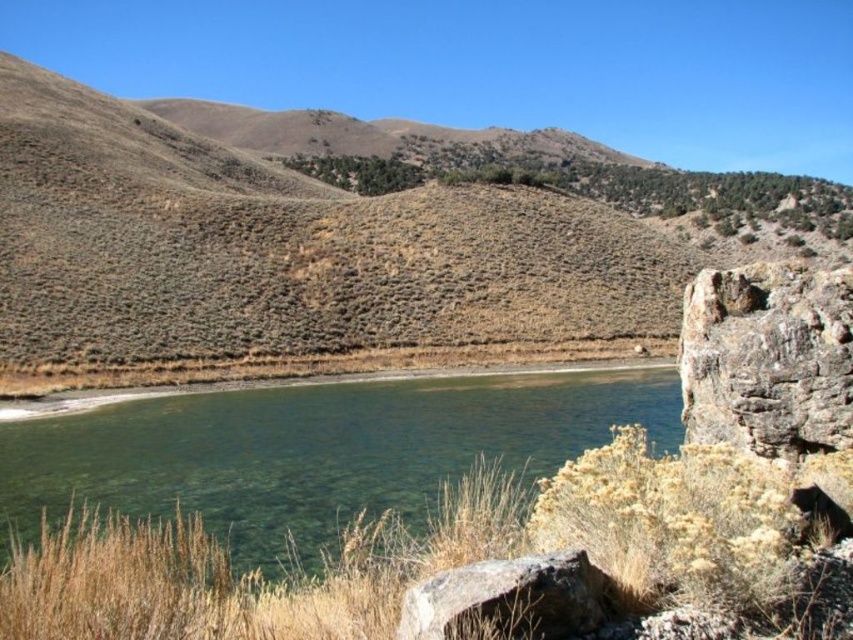
From the picture: Who is positioned more to the right, brown/dry grassy hillside at center or clear water at center?

brown/dry grassy hillside at center

Is point (320, 204) behind point (244, 468)?

Yes.

Locate an element on the screen. brown/dry grassy hillside at center is located at coordinates (346, 241).

Between point (345, 188) and point (589, 586), which one is positioned in front?

Point (589, 586)

You are a GUI agent. You are given a task and a screenshot of the screen. Output one action in this format:
    pyautogui.click(x=<x>, y=<y>)
    Task: Click on the brown/dry grassy hillside at center
    The image size is (853, 640).
    Given the screenshot: What is the action you would take?
    pyautogui.click(x=346, y=241)

Does clear water at center have a greater width compared to rocky at lower right?

Indeed, clear water at center has a greater width compared to rocky at lower right.

Between point (363, 472) and point (552, 572), which one is positioned in front?

Point (552, 572)

What do you see at coordinates (315, 451) in the screenshot? This screenshot has width=853, height=640. I see `clear water at center` at bounding box center [315, 451].

At what (x,y) coordinates should I click in order to perform the action: click on clear water at center. Please return your answer as a coordinate pair (x, y). The height and width of the screenshot is (640, 853). Looking at the image, I should click on (315, 451).